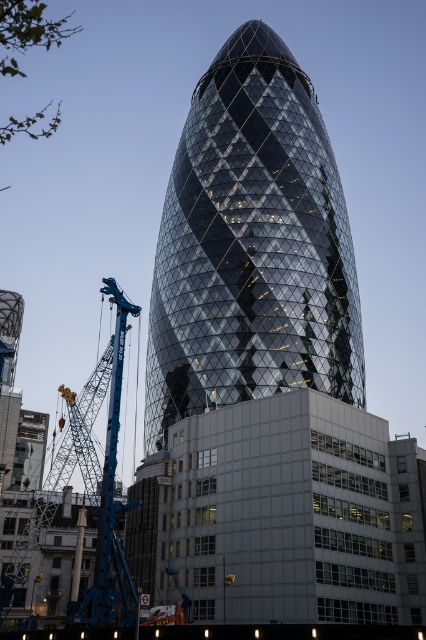
You are standing in front of the Gherkin building. There is a point at coordinates point (229,305) that you want to reach. Can you estimate how far you need to walk to get there?

The point (229,305) is 71.66 meters away from the viewer, so you need to walk approximately 71.66 meters to reach it.

You are standing at the entrance of the smaller building in the foreground. You want to walk directly towards the glassy steel tower at center. What direction should you head in?

Since the glassy steel tower at center is located at coordinates point (252, 246), you should head in the direction of those coordinates from your current position at the entrance of the smaller building in the foreground.